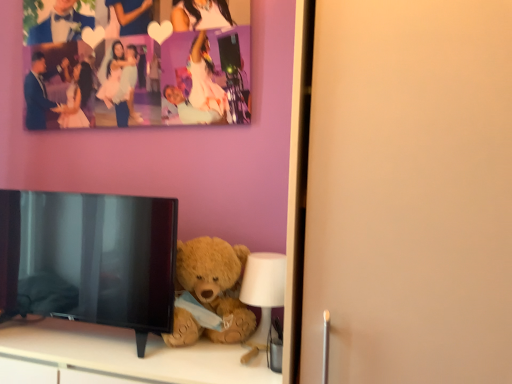
Find the location of a particular element. blank space above soft beige teddy bear at lower center (from a real-world perspective) is located at coordinates (99, 340).